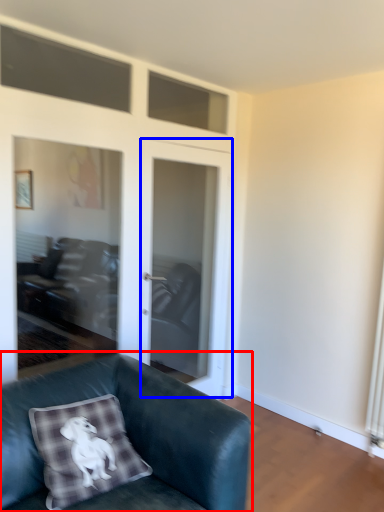
Question: Which object appears farthest to the camera in this image, studio couch (highlighted by a red box) or screen door (highlighted by a blue box)?

Choices:
 (A) studio couch
 (B) screen door

Answer: (B)